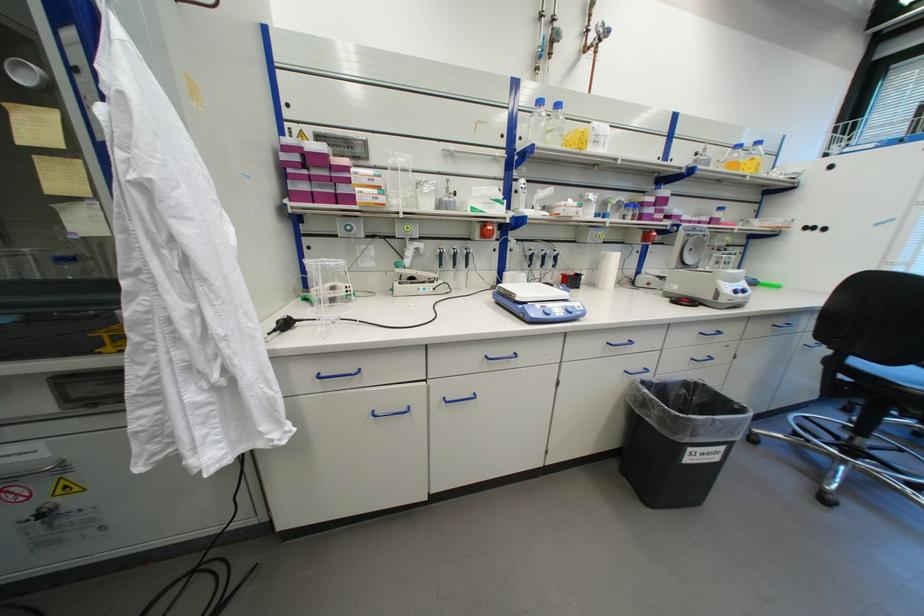
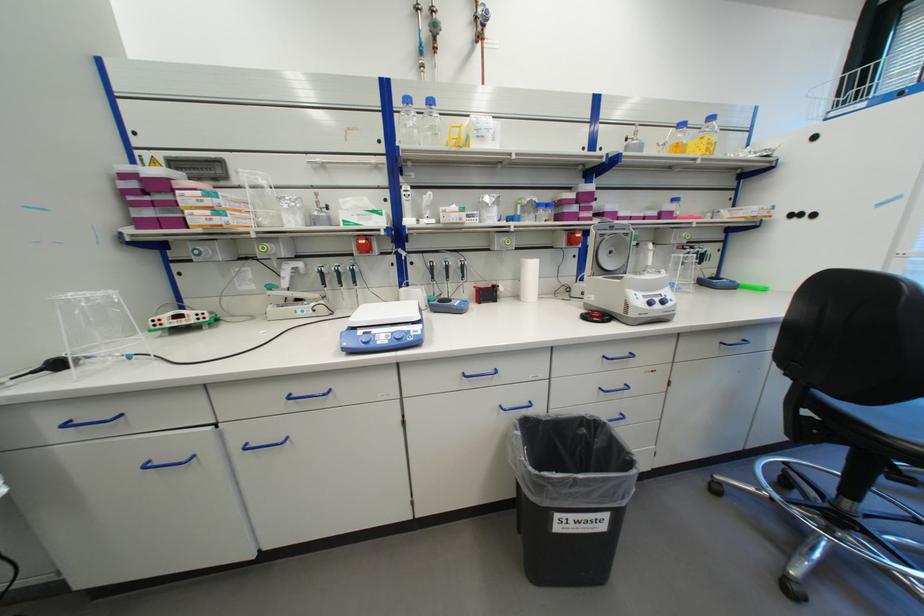
Find the pixel in the second image that matches (x=492, y=236) in the first image.

(373, 249)